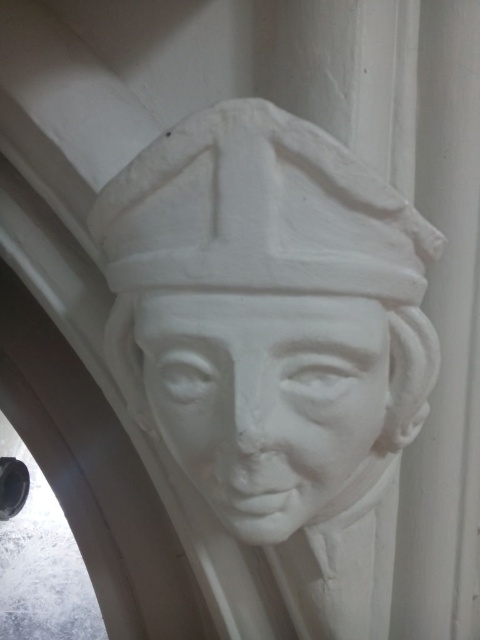
Who is more forward, (278, 320) or (255, 499)?

Point (278, 320) is in front.

Does point (383, 372) come behind point (241, 536)?

That is False.

Find the location of a particular element. white marble bust at center is located at coordinates (267, 314).

Locate an element on the screen. The height and width of the screenshot is (640, 480). white marble bust at center is located at coordinates (267, 314).